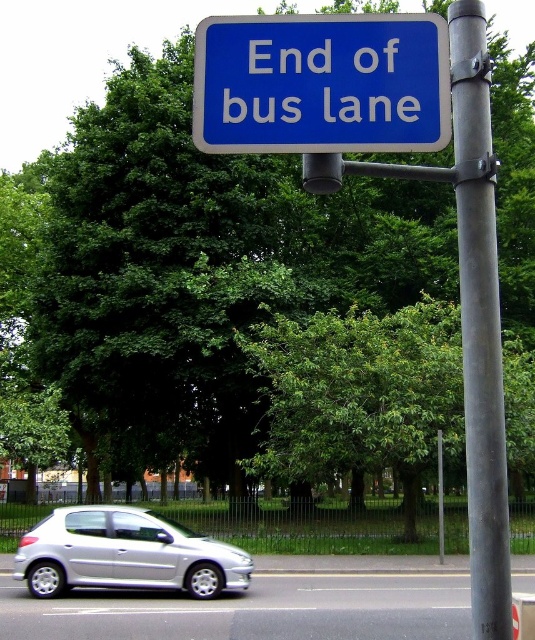
Between point (483, 424) and point (39, 557), which one is positioned in front?

Point (483, 424)

Is metallic gray pole at center right to the left of silver metallic car at lower left from the viewer's perspective?

No, metallic gray pole at center right is not to the left of silver metallic car at lower left.

The height and width of the screenshot is (640, 535). What do you see at coordinates (479, 323) in the screenshot?
I see `metallic gray pole at center right` at bounding box center [479, 323].

You are a GUI agent. You are given a task and a screenshot of the screen. Output one action in this format:
    pyautogui.click(x=<x>, y=<y>)
    Task: Click on the metallic gray pole at center right
    Image resolution: width=535 pixels, height=640 pixels.
    Given the screenshot: What is the action you would take?
    pyautogui.click(x=479, y=323)

Which is in front, point (224, 83) or point (462, 312)?

Point (462, 312) is more forward.

Is point (214, 125) less distant than point (473, 605)?

No, it is not.

This screenshot has height=640, width=535. I want to click on blue plastic sign at upper center, so click(x=322, y=83).

Does blue plastic sign at upper center appear on the left side of silver metallic car at lower left?

Incorrect, blue plastic sign at upper center is not on the left side of silver metallic car at lower left.

Who is lower down, blue plastic sign at upper center or silver metallic car at lower left?

silver metallic car at lower left

Identify the location of blue plastic sign at upper center. 322,83.